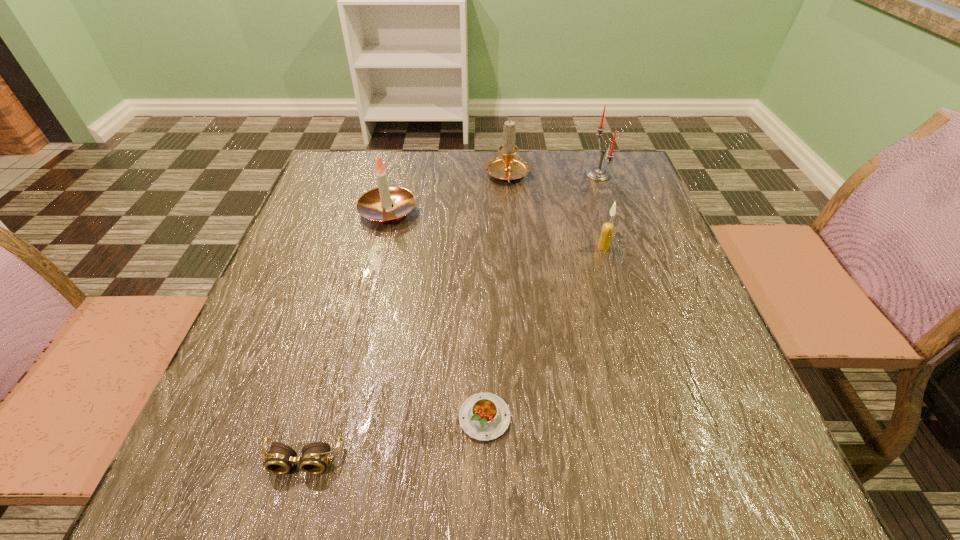
Find the location of a particular element. The image size is (960, 540). goggles present at the left edge is located at coordinates (279, 460).

Locate an element on the screen. The height and width of the screenshot is (540, 960). object that is positioned at the far left corner is located at coordinates (376, 204).

You are a GUI agent. You are given a task and a screenshot of the screen. Output one action in this format:
    pyautogui.click(x=<x>, y=<y>)
    Task: Click on the object that is at the near left corner
    This screenshot has height=540, width=960.
    Given the screenshot: What is the action you would take?
    pyautogui.click(x=279, y=460)

I want to click on object that is at the far right corner, so click(x=599, y=174).

This screenshot has height=540, width=960. I want to click on vacant space at the far edge, so click(444, 192).

I want to click on vacant space at the near edge, so click(438, 462).

In the image, there is a desktop. Where is `blank space at the left edge`? Image resolution: width=960 pixels, height=540 pixels. blank space at the left edge is located at coordinates (321, 372).

Identify the location of vacant space at the right edge. Image resolution: width=960 pixels, height=540 pixels. (652, 221).

In the image, there is a desktop. Identify the location of free space at the far left corner. This screenshot has height=540, width=960. 356,192.

At what (x,y) coordinates should I click in order to perform the action: click on free space at the far right corner of the desktop. Please return your answer as a coordinate pair (x, y). Image resolution: width=960 pixels, height=540 pixels. Looking at the image, I should click on (641, 194).